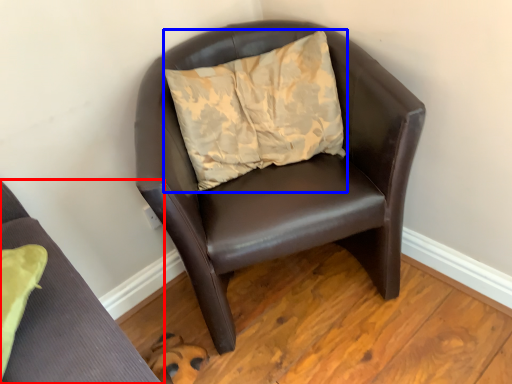
Question: Which of the following is the farthest to the observer, chair (highlighted by a red box) or pillow (highlighted by a blue box)?

Choices:
 (A) chair
 (B) pillow

Answer: (B)